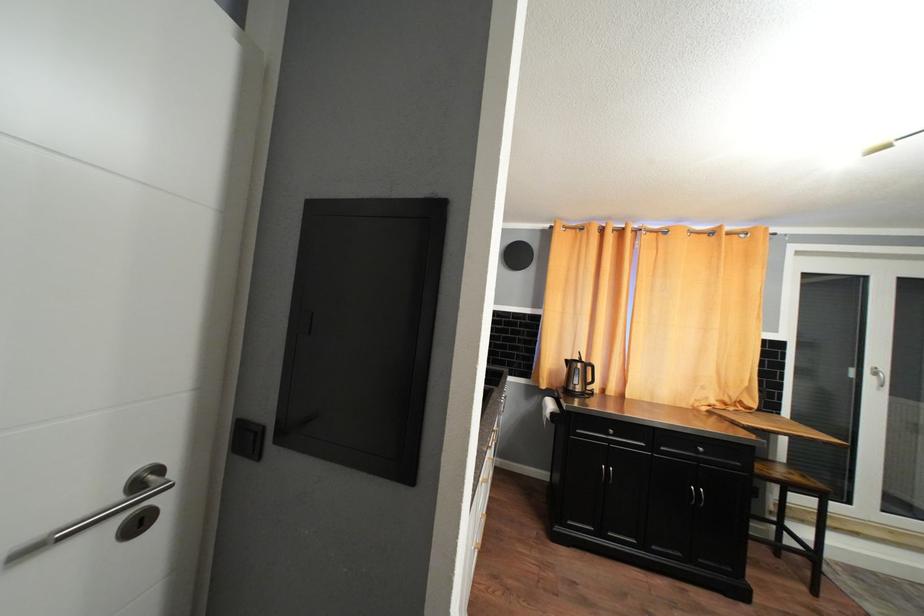
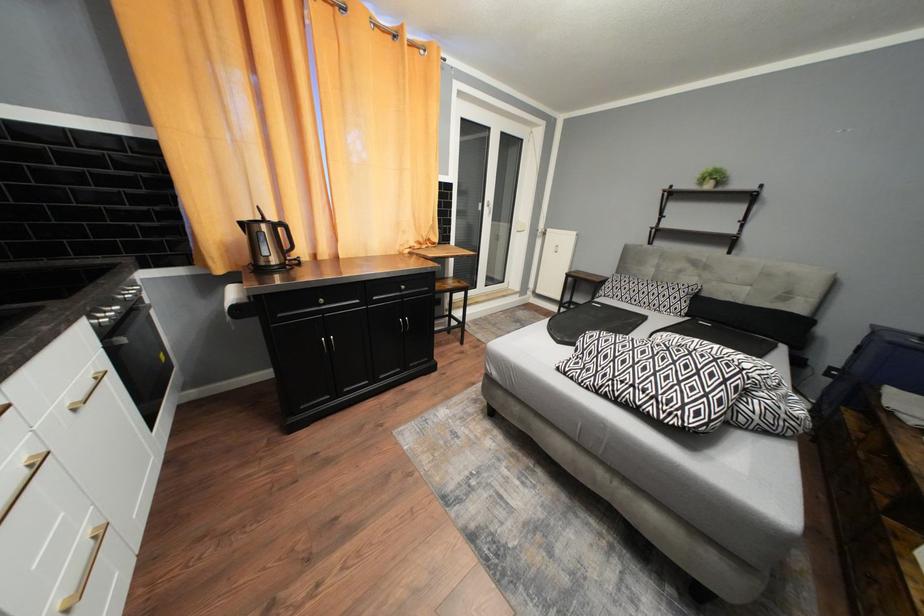
The first image is from the beginning of the video and the second image is from the end. How did the camera likely rotate when shooting the video?

The camera rotated toward right-down.